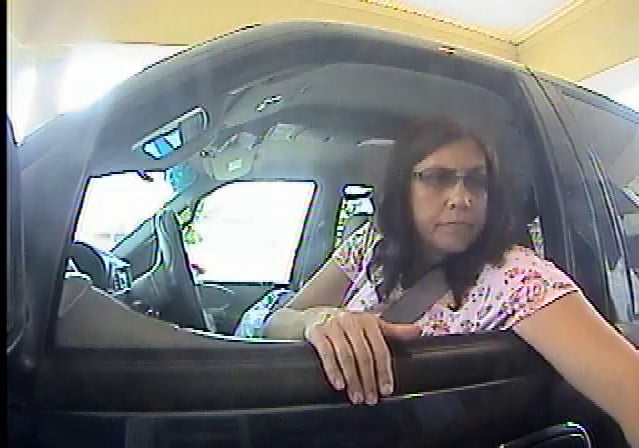
Where is `vent`? The image size is (639, 448). vent is located at coordinates (116, 280).